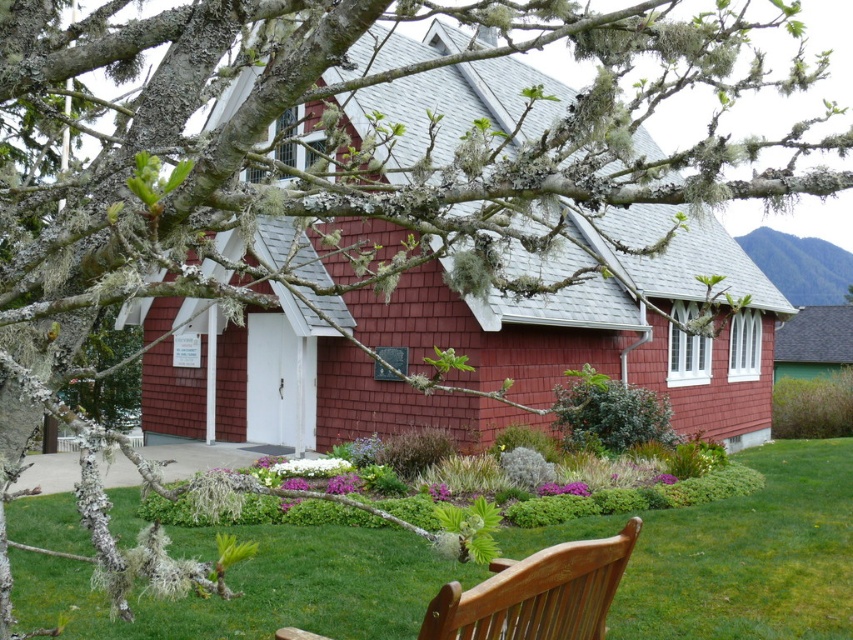
Question: Can you confirm if green grass at lower center is wider than wooden park bench at lower right?

Choices:
 (A) no
 (B) yes

Answer: (B)

Question: Observing the image, what is the correct spatial positioning of red shingle cottage at center in reference to wooden park bench at lower right?

Choices:
 (A) above
 (B) below

Answer: (A)

Question: Which of the following is the closest to the observer?

Choices:
 (A) red shingle cottage at center
 (B) green grass at lower center

Answer: (A)

Question: Estimate the real-world distances between objects in this image. Which object is farther from the green grass at lower center?

Choices:
 (A) red shingle cottage at center
 (B) wooden park bench at lower right

Answer: (A)

Question: Can you confirm if green grass at lower center is positioned to the left of wooden park bench at lower right?

Choices:
 (A) yes
 (B) no

Answer: (B)

Question: Based on their relative distances, which object is farther from the green grass at lower center?

Choices:
 (A) red shingle cottage at center
 (B) wooden park bench at lower right

Answer: (A)